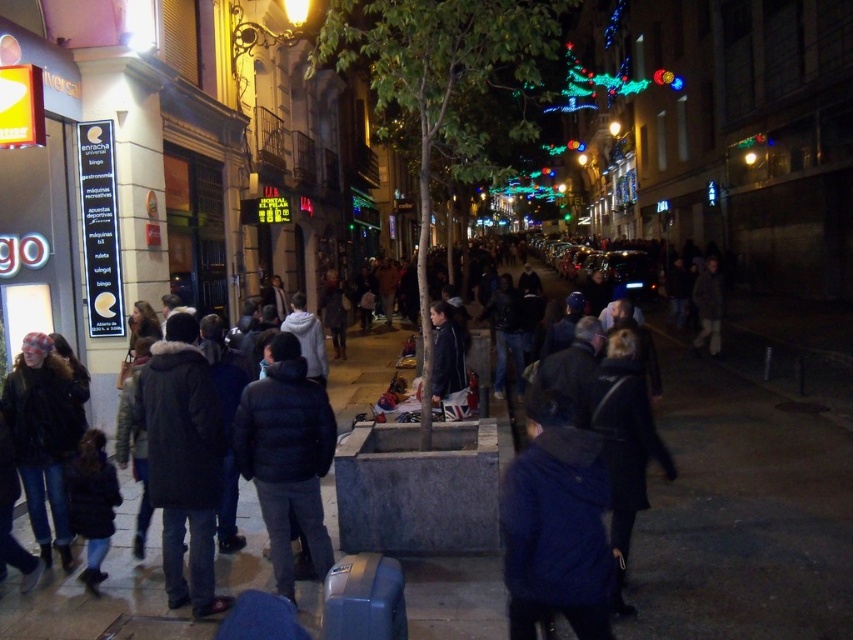
You are a delivery person trying to navigate through the crowded street. You see the concrete sidewalk at center and the black puffy jacket at center. Which one is higher from the ground?

The concrete sidewalk at center is positioned over the black puffy jacket at center, so the concrete sidewalk at center is higher.

You are a photographer trying to capture a candid shot of the blue fuzzy jacket at center and the black puffy jacket at center in the same frame. Since both are in the crowd, you need to adjust your camera to focus on both. Which jacket should you focus on first if you want to ensure both are in focus, considering their sizes?

The blue fuzzy jacket at center has a smaller size compared to the black puffy jacket at center. To ensure both are in focus, you should focus on the smaller blue fuzzy jacket at center first, as it requires a more precise focus due to its smaller size to maintain clarity.

You are standing on the blue fuzzy jacket at center and want to walk to the concrete sidewalk at center. In which direction should you move?

You should move to the right to reach the concrete sidewalk at center from the blue fuzzy jacket at center since the concrete sidewalk at center is located to the right of the blue fuzzy jacket at center.